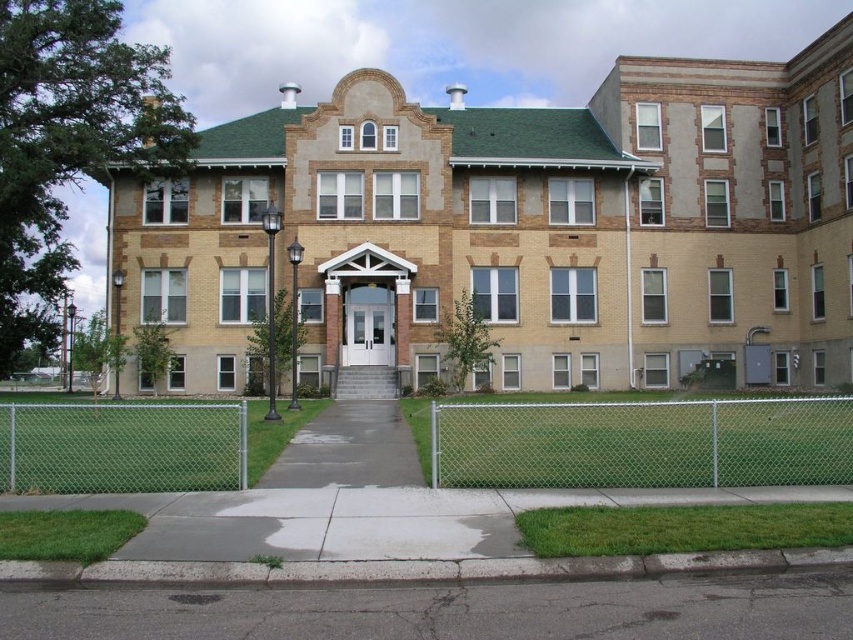
You are standing at the entrance of the multi story building and want to walk to the gray asphalt at lower center. Which direction should you walk relative to the building?

You should walk forward towards the gray asphalt at lower center because it is located at the lower center of the scene, directly in front of the building entrance.